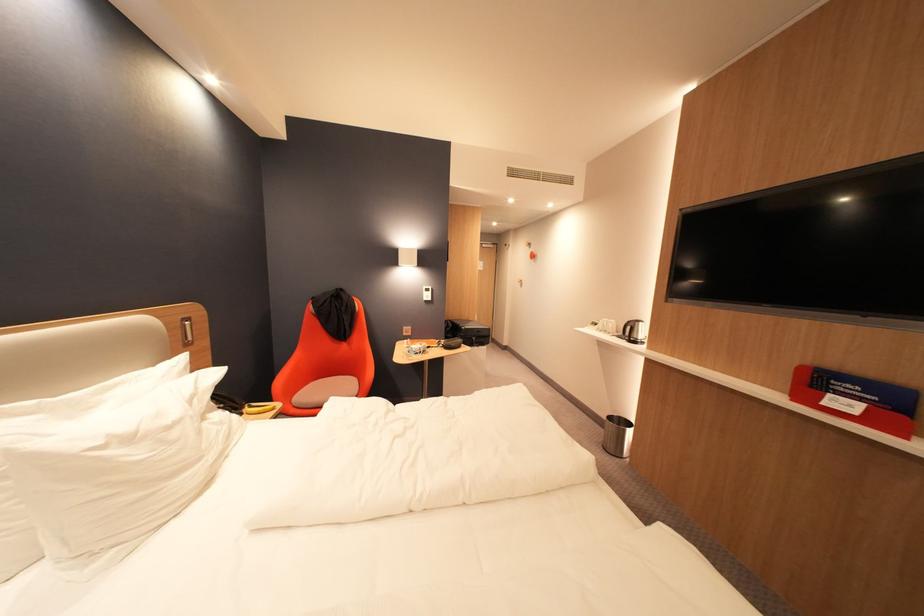
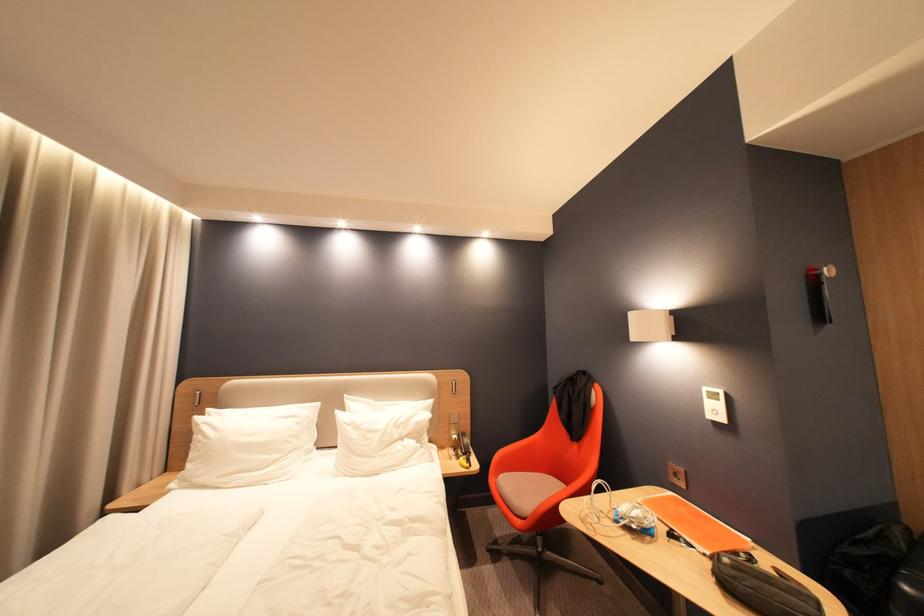
Where in the second image is the point corresponding to pixel 446 347 from the first image?

(714, 556)